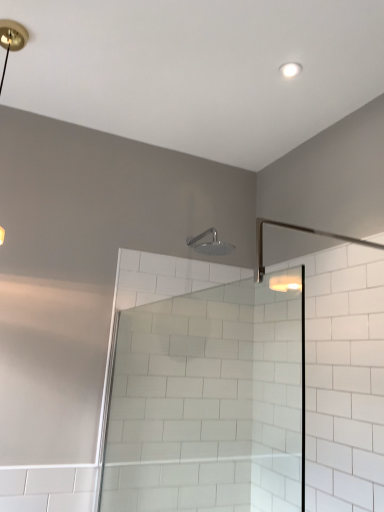
Question: From a real-world perspective, is matte gold light fixture at upper left located beneath satin nickel shower head at upper center?

Choices:
 (A) yes
 (B) no

Answer: (B)

Question: Can you confirm if matte gold light fixture at upper left is bigger than satin nickel shower head at upper center?

Choices:
 (A) yes
 (B) no

Answer: (A)

Question: Is satin nickel shower head at upper center surrounded by matte gold light fixture at upper left?

Choices:
 (A) no
 (B) yes

Answer: (A)

Question: Is matte gold light fixture at upper left closer to the viewer compared to satin nickel shower head at upper center?

Choices:
 (A) yes
 (B) no

Answer: (A)

Question: From the image's perspective, is matte gold light fixture at upper left on top of satin nickel shower head at upper center?

Choices:
 (A) no
 (B) yes

Answer: (B)

Question: Considering the positions of matte gold light fixture at upper left and satin nickel shower head at upper center in the image, is matte gold light fixture at upper left bigger or smaller than satin nickel shower head at upper center?

Choices:
 (A) big
 (B) small

Answer: (A)

Question: In the image, is matte gold light fixture at upper left positioned in front of or behind satin nickel shower head at upper center?

Choices:
 (A) front
 (B) behind

Answer: (A)

Question: Looking at their shapes, would you say matte gold light fixture at upper left is wider or thinner than satin nickel shower head at upper center?

Choices:
 (A) thin
 (B) wide

Answer: (A)

Question: From the image's perspective, is matte gold light fixture at upper left above or below satin nickel shower head at upper center?

Choices:
 (A) above
 (B) below

Answer: (A)

Question: Is satin nickel shower head at upper center bigger or smaller than clear glass shower door at center?

Choices:
 (A) small
 (B) big

Answer: (A)

Question: Is satin nickel shower head at upper center taller or shorter than clear glass shower door at center?

Choices:
 (A) tall
 (B) short

Answer: (B)

Question: In terms of width, does satin nickel shower head at upper center look wider or thinner when compared to clear glass shower door at center?

Choices:
 (A) wide
 (B) thin

Answer: (B)

Question: Is satin nickel shower head at upper center inside or outside of clear glass shower door at center?

Choices:
 (A) outside
 (B) inside

Answer: (A)

Question: Visually, is matte gold light fixture at upper left positioned to the left or to the right of clear glass shower door at center?

Choices:
 (A) right
 (B) left

Answer: (B)

Question: Looking at the image, does matte gold light fixture at upper left seem bigger or smaller compared to clear glass shower door at center?

Choices:
 (A) small
 (B) big

Answer: (A)